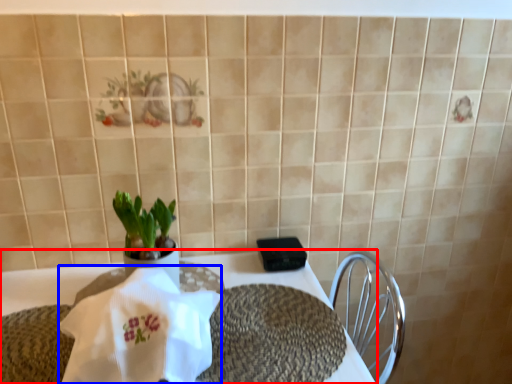
Question: Which point is closer to the camera, table (highlighted by a red box) or cloth (highlighted by a blue box)?

Choices:
 (A) table
 (B) cloth

Answer: (B)